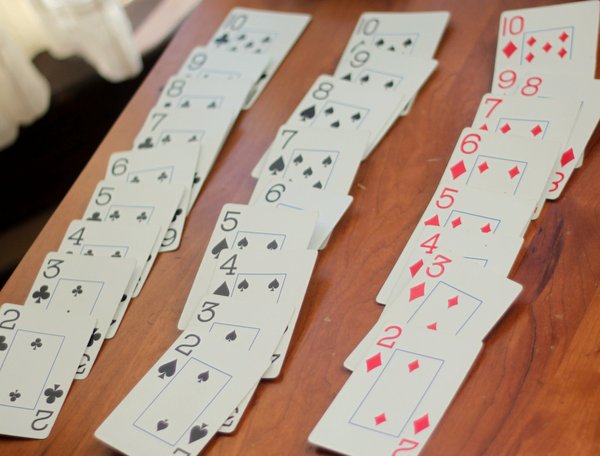
Where is `curtain`? curtain is located at coordinates [x=86, y=28].